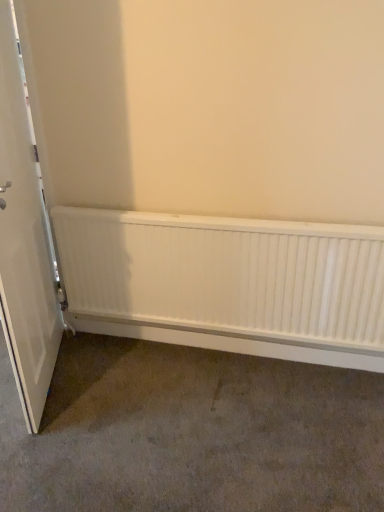
Question: Is white matte door at left outside of white matte radiator at lower center?

Choices:
 (A) no
 (B) yes

Answer: (B)

Question: Is the depth of white matte door at left less than that of white matte radiator at lower center?

Choices:
 (A) yes
 (B) no

Answer: (A)

Question: Can you confirm if white matte door at left is positioned to the right of white matte radiator at lower center?

Choices:
 (A) no
 (B) yes

Answer: (A)

Question: Is white matte door at left oriented towards white matte radiator at lower center?

Choices:
 (A) no
 (B) yes

Answer: (B)

Question: Is white matte door at left looking in the opposite direction of white matte radiator at lower center?

Choices:
 (A) no
 (B) yes

Answer: (B)

Question: Is white matte door at left further to the viewer compared to white matte radiator at lower center?

Choices:
 (A) no
 (B) yes

Answer: (A)

Question: Considering the relative positions of white matte radiator at lower center and white matte door at left in the image provided, is white matte radiator at lower center to the right of white matte door at left from the viewer's perspective?

Choices:
 (A) yes
 (B) no

Answer: (A)

Question: Is white matte radiator at lower center thinner than white matte door at left?

Choices:
 (A) no
 (B) yes

Answer: (B)

Question: Could you tell me if white matte radiator at lower center is turned towards white matte door at left?

Choices:
 (A) yes
 (B) no

Answer: (A)

Question: Can white matte door at left be found inside white matte radiator at lower center?

Choices:
 (A) yes
 (B) no

Answer: (B)

Question: Is white matte door at left at the back of white matte radiator at lower center?

Choices:
 (A) yes
 (B) no

Answer: (B)

Question: Considering the relative positions of white matte radiator at lower center and white matte door at left in the image provided, is white matte radiator at lower center behind white matte door at left?

Choices:
 (A) yes
 (B) no

Answer: (A)

Question: In terms of width, does white matte door at left look wider or thinner when compared to white matte radiator at lower center?

Choices:
 (A) thin
 (B) wide

Answer: (B)